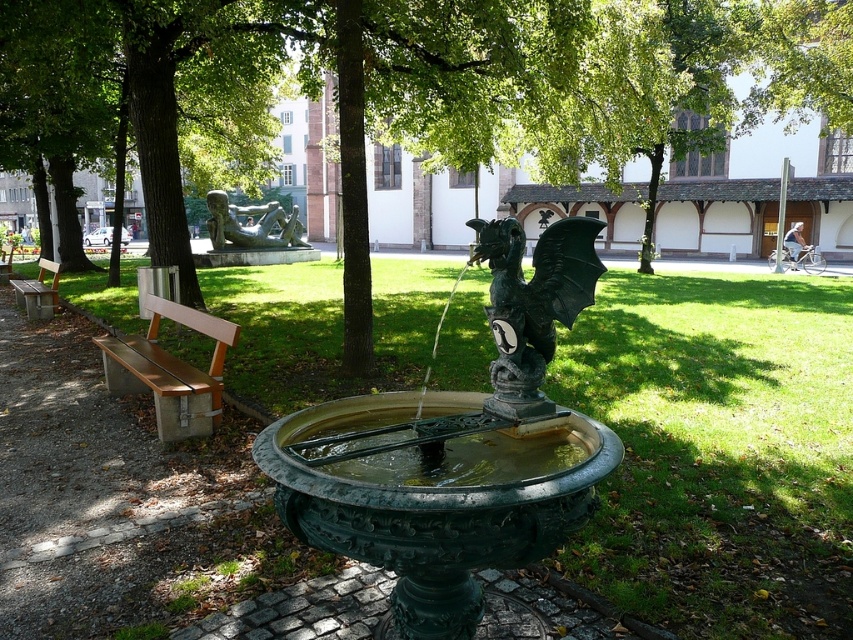
You are a park visitor who wants to take a photo of both the green polished stone dragon at center and the bronze statue at center in the same frame. Given that your camera has a maximum zoom range of 20 meters, will you be able to capture both subjects in one shot?

The distance between the green polished stone dragon at center and the bronze statue at center is 20.69 meters. Since your camera can zoom up to 20 meters, you will not be able to capture both subjects in a single frame without moving closer or adjusting your position.

You are standing in the park and want to sit on the wooden bench at left. Which object will you pass first as you walk towards it from the bronze statue at center?

The bronze statue at center is closer to you than the wooden bench at left, so you will pass the bronze statue at center first before reaching the wooden bench at left.

Based on the photo, you are planning to place a new flower pot between the bronze statue at center and the wooden bench at left. Considering their widths, which object should the flower pot be closer to?

The bronze statue at center is wider than the wooden bench at left. Therefore, the flower pot should be placed closer to the wooden bench at left to maintain balance between the two objects.